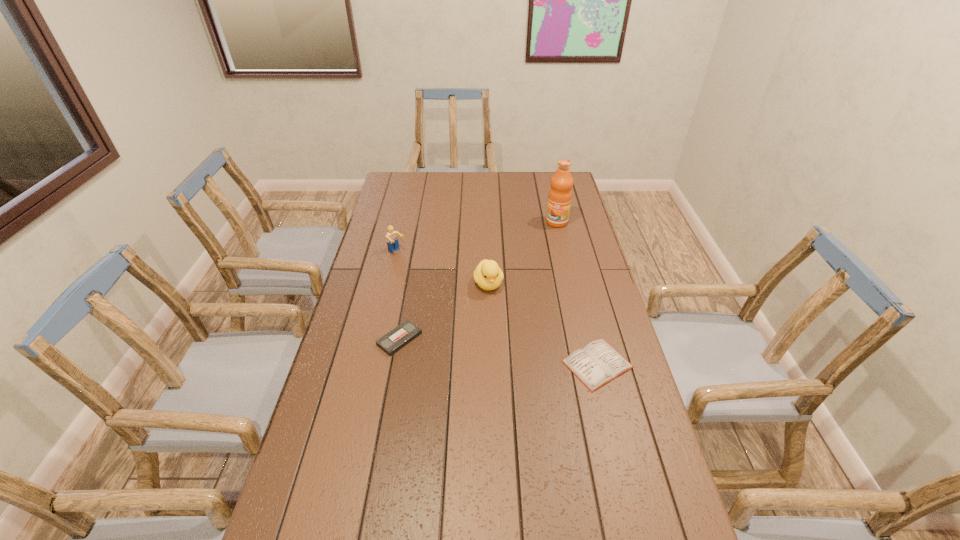
Identify the location of free space located on the front-facing side of the third nearest object. The width and height of the screenshot is (960, 540). (509, 339).

Where is `free space located on the front-facing side of the third nearest object`? The image size is (960, 540). free space located on the front-facing side of the third nearest object is located at coordinates 516,356.

The height and width of the screenshot is (540, 960). I want to click on free space located 0.080m on the face of the second farthest object, so click(x=415, y=267).

Identify the location of vacant space situated 0.330m on the face of the second farthest object. The image size is (960, 540). (456, 301).

Find the location of a particular element. Image resolution: width=960 pixels, height=540 pixels. vacant space located on the face of the second farthest object is located at coordinates (442, 289).

I want to click on free region located on the label side of the fruit juice, so click(x=538, y=254).

What are the coordinates of `vacant position located on the label side of the fruit juice` in the screenshot? It's located at (529, 268).

Identify the location of free location located 0.390m on the label side of the fruit juice. The height and width of the screenshot is (540, 960). (519, 284).

Identify the location of videotape at the left edge. This screenshot has height=540, width=960. (397, 338).

Identify the location of Lego located at the left edge. The width and height of the screenshot is (960, 540). (391, 237).